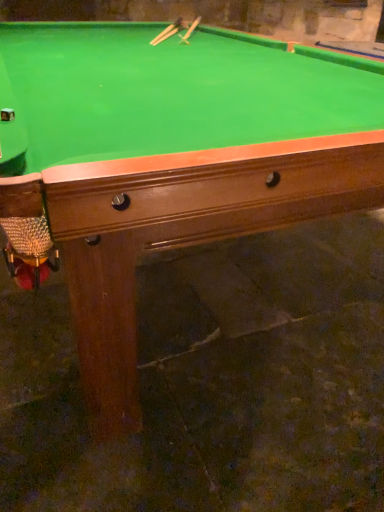
Locate an element on the screen. The image size is (384, 512). free space in front of wooden cue at upper center, arranged as the second cue when viewed from the left is located at coordinates (181, 42).